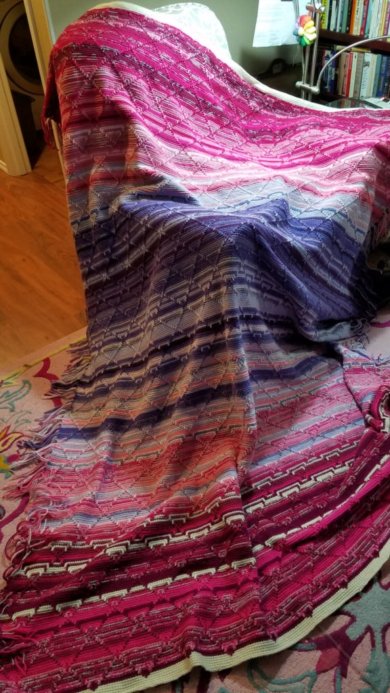
Find the location of a particular element. blanket is located at coordinates (188, 522).